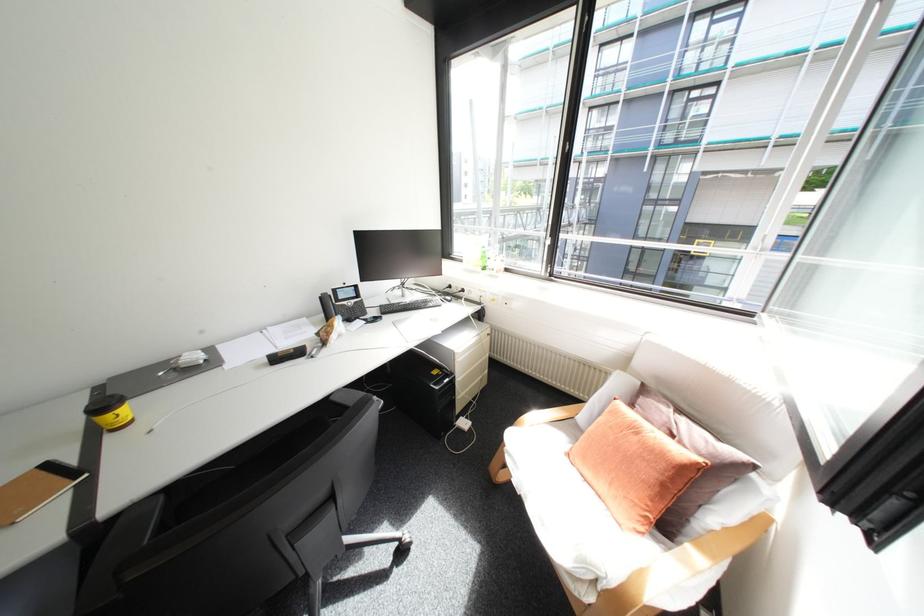
Find where to slid the computer mouse. Please return your answer as a coordinate pair (x, y).

(371, 318)